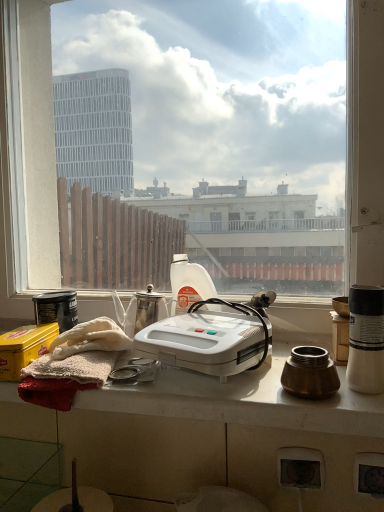
Where is `free space to the left of matte brown jar at right, positioned as the 1th appliance in right-to-left order`? This screenshot has width=384, height=512. free space to the left of matte brown jar at right, positioned as the 1th appliance in right-to-left order is located at coordinates (230, 389).